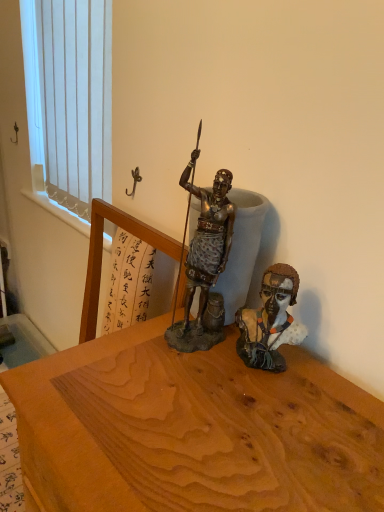
Describe the element at coordinates (270, 321) in the screenshot. I see `matte brown bust at center right` at that location.

You are a GUI agent. You are given a task and a screenshot of the screen. Output one action in this format:
    pyautogui.click(x=<x>, y=<y>)
    Task: Click on the matte brown bust at center right
    The image size is (384, 512).
    Given the screenshot: What is the action you would take?
    click(270, 321)

At what (x,y) coordinates should I click in order to perform the action: click on white vertical blinds at upper left. Please return your answer as a coordinate pair (x, y). The height and width of the screenshot is (512, 384). Looking at the image, I should click on (72, 94).

Describe the element at coordinates (72, 94) in the screenshot. The width and height of the screenshot is (384, 512). I see `white vertical blinds at upper left` at that location.

Measure the distance between white vertical blinds at upper left and camera.

3.41 feet.

At what (x,y) coordinates should I click in order to perform the action: click on matte brown bust at center right. Please return your answer as a coordinate pair (x, y). Image resolution: width=384 pixels, height=512 pixels. Looking at the image, I should click on (270, 321).

Considering the relative positions of matte brown bust at center right and white vertical blinds at upper left in the image provided, is matte brown bust at center right to the left or to the right of white vertical blinds at upper left?

matte brown bust at center right is positioned on white vertical blinds at upper left's right side.

Which object is more forward, matte brown bust at center right or white vertical blinds at upper left?

matte brown bust at center right.

Which is closer to the camera, (266, 327) or (102, 185)?

Positioned in front is point (266, 327).

From the image's perspective, does matte brown bust at center right appear lower than white vertical blinds at upper left?

Correct, matte brown bust at center right appears lower than white vertical blinds at upper left in the image.

From a real-world perspective, is matte brown bust at center right positioned above or below white vertical blinds at upper left?

matte brown bust at center right is below white vertical blinds at upper left.

Which object is thinner, matte brown bust at center right or white vertical blinds at upper left?

white vertical blinds at upper left is thinner.

From their relative heights in the image, would you say matte brown bust at center right is taller or shorter than white vertical blinds at upper left?

In the image, matte brown bust at center right appears to be shorter than white vertical blinds at upper left.

Who is bigger, matte brown bust at center right or white vertical blinds at upper left?

white vertical blinds at upper left is bigger.

Is matte brown bust at center right not inside white vertical blinds at upper left?

Absolutely, matte brown bust at center right is external to white vertical blinds at upper left.

Consider the image. Is matte brown bust at center right not close to white vertical blinds at upper left?

No.

Is matte brown bust at center right oriented towards white vertical blinds at upper left?

No, matte brown bust at center right is not turned towards white vertical blinds at upper left.

Measure the distance from matte brown bust at center right to white vertical blinds at upper left.

matte brown bust at center right is 35.79 inches from white vertical blinds at upper left.

In order to click on person that appears in front of the white vertical blinds at upper left in this screenshot , I will do `click(270, 321)`.

Which object is positioned more to the right, white vertical blinds at upper left or matte brown bust at center right?

matte brown bust at center right is more to the right.

Is white vertical blinds at upper left positioned before matte brown bust at center right?

No, white vertical blinds at upper left is further to the viewer.

Considering the points (91, 144) and (291, 291), which point is behind, point (91, 144) or point (291, 291)?

The point (91, 144) is more distant.

From the image's perspective, who appears lower, white vertical blinds at upper left or matte brown bust at center right?

matte brown bust at center right is shown below in the image.

In the scene shown: From a real-world perspective, which is physically above, white vertical blinds at upper left or matte brown bust at center right?

From a 3D spatial view, white vertical blinds at upper left is above.

Considering the sizes of objects white vertical blinds at upper left and matte brown bust at center right in the image provided, who is wider, white vertical blinds at upper left or matte brown bust at center right?

matte brown bust at center right.

Considering the relative sizes of white vertical blinds at upper left and matte brown bust at center right in the image provided, is white vertical blinds at upper left shorter than matte brown bust at center right?

No, white vertical blinds at upper left is not shorter than matte brown bust at center right.

Can you confirm if white vertical blinds at upper left is smaller than matte brown bust at center right?

No.

Is white vertical blinds at upper left completely or partially outside of matte brown bust at center right?

Indeed, white vertical blinds at upper left is completely outside matte brown bust at center right.

From the picture: Is white vertical blinds at upper left directly adjacent to matte brown bust at center right?

There is a gap between white vertical blinds at upper left and matte brown bust at center right.

Is white vertical blinds at upper left facing towards matte brown bust at center right?

No, white vertical blinds at upper left is not facing towards matte brown bust at center right.

How distant is white vertical blinds at upper left from matte brown bust at center right?

A distance of 90.90 centimeters exists between white vertical blinds at upper left and matte brown bust at center right.

The width and height of the screenshot is (384, 512). I want to click on window positioned vertically above the matte brown bust at center right (from a real-world perspective), so click(72, 94).

This screenshot has height=512, width=384. Identify the location of person on the right of white vertical blinds at upper left. (270, 321).

Where is `person in front of the white vertical blinds at upper left`? The image size is (384, 512). person in front of the white vertical blinds at upper left is located at coordinates (270, 321).